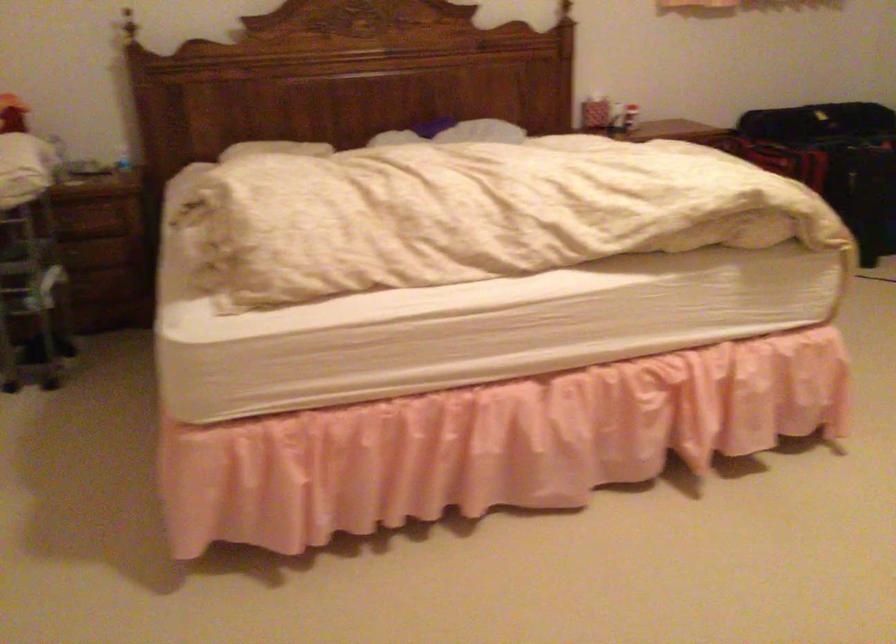
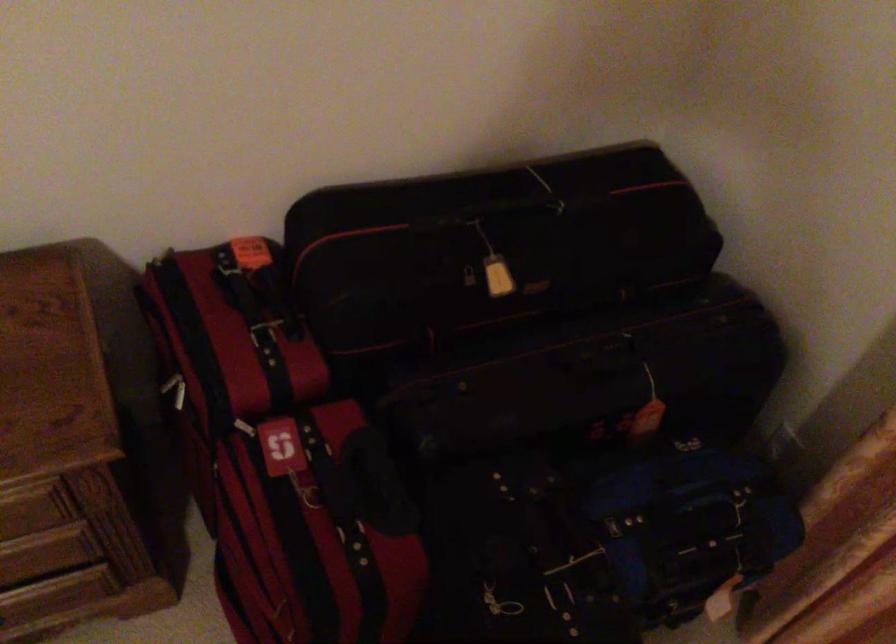
Locate, in the second image, the point that corresponds to point (819, 88) in the first image.

(470, 287)